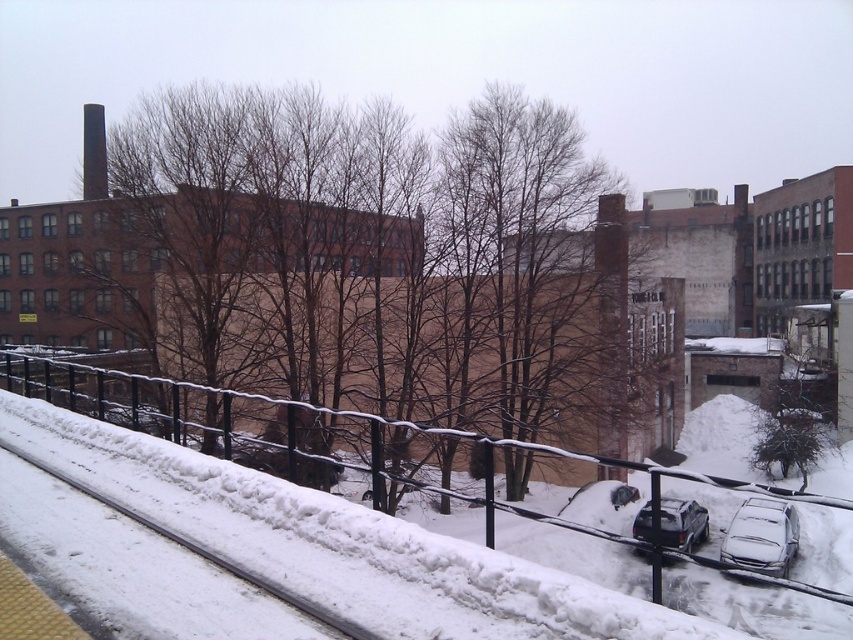
You are a delivery driver who needs to park your truck, which is 6 meters long, in the parking lot near the snow covered embankment. The parking spot is between the sleek silver sedan at lower right and the satin black suv at lower right. Can your truck fit in the space between them?

The sleek silver sedan at lower right is smaller than the satin black suv at lower right, but the exact distance between them isn